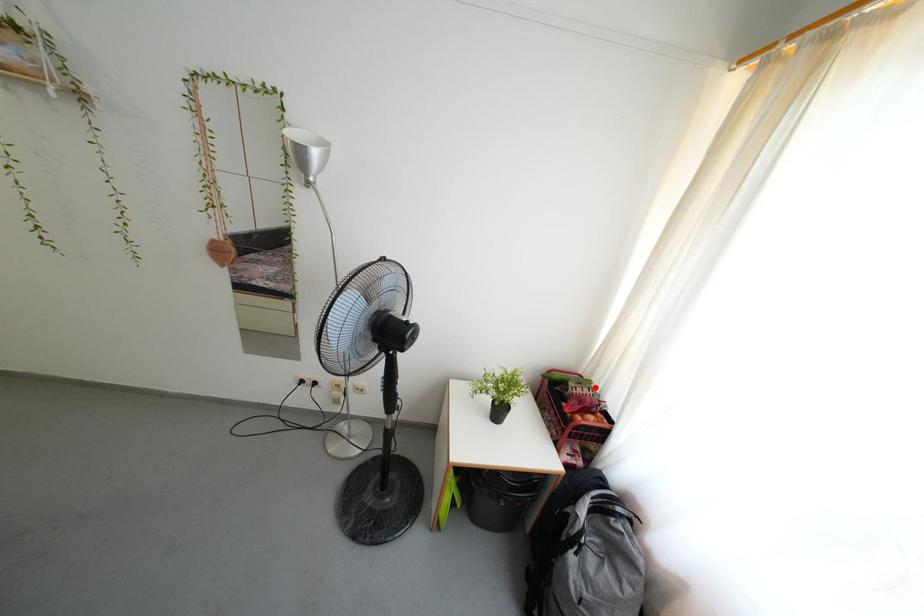
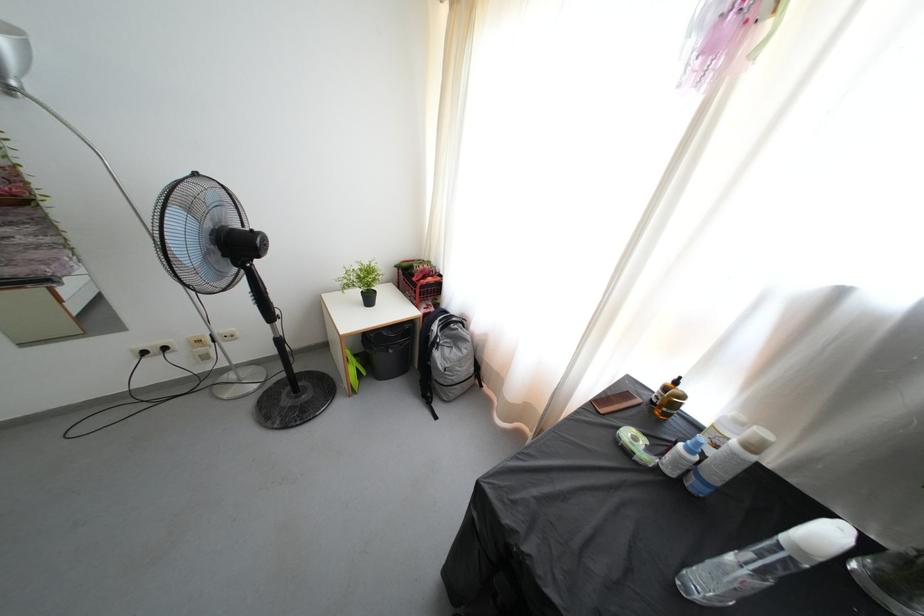
Find the pixel in the second image that matches the highlighted location in the first image.

(434, 268)